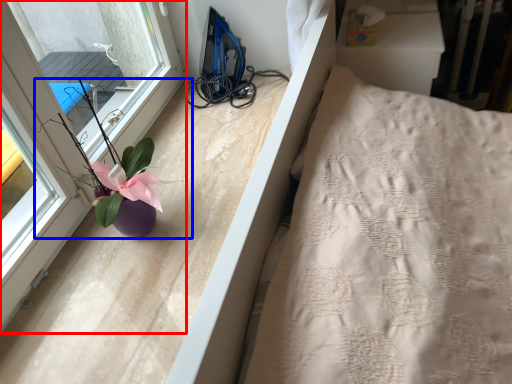
Question: Among these objects, which one is farthest to the camera, window (highlighted by a red box) or floral arrangement (highlighted by a blue box)?

Choices:
 (A) window
 (B) floral arrangement

Answer: (B)